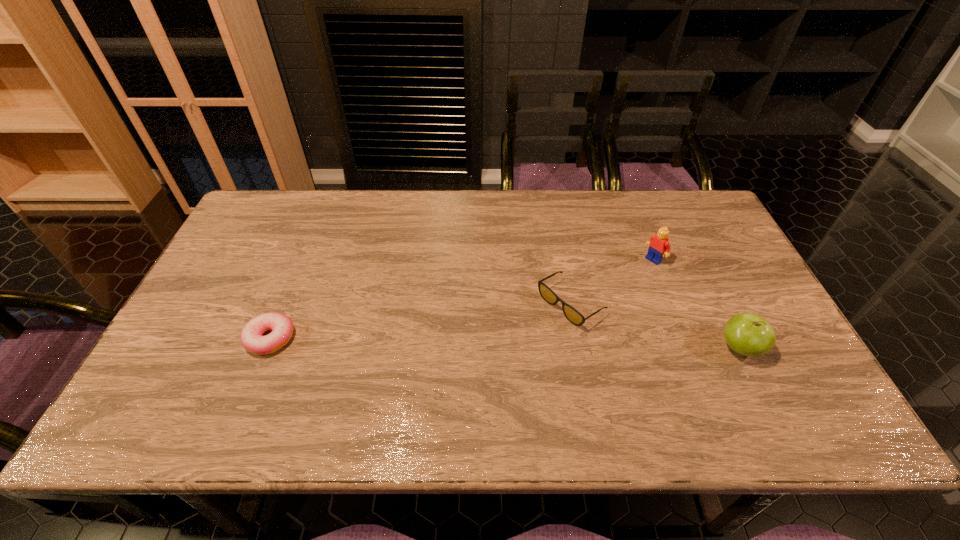
Where is `doughnut`? The height and width of the screenshot is (540, 960). doughnut is located at coordinates (281, 325).

The image size is (960, 540). In order to click on the leftmost object in this screenshot , I will do `click(281, 325)`.

In order to click on apple in this screenshot , I will do `click(747, 334)`.

The height and width of the screenshot is (540, 960). What are the coordinates of `the farthest object` in the screenshot? It's located at (658, 244).

Where is `the second object from right to left`? the second object from right to left is located at coordinates (658, 244).

This screenshot has width=960, height=540. In order to click on the third tallest object in this screenshot , I will do `click(575, 317)`.

You are a GUI agent. You are given a task and a screenshot of the screen. Output one action in this format:
    pyautogui.click(x=<x>, y=<y>)
    Task: Click on the second object from left to right
    
    Given the screenshot: What is the action you would take?
    pyautogui.click(x=575, y=317)

Identify the location of vacant region located on the left of the leftmost object. The height and width of the screenshot is (540, 960). (214, 339).

Locate an element on the screen. free space located 0.270m on the back of the rightmost object is located at coordinates 695,258.

In order to click on free space located 0.150m on the face of the second object from right to left in this screenshot , I will do `click(615, 289)`.